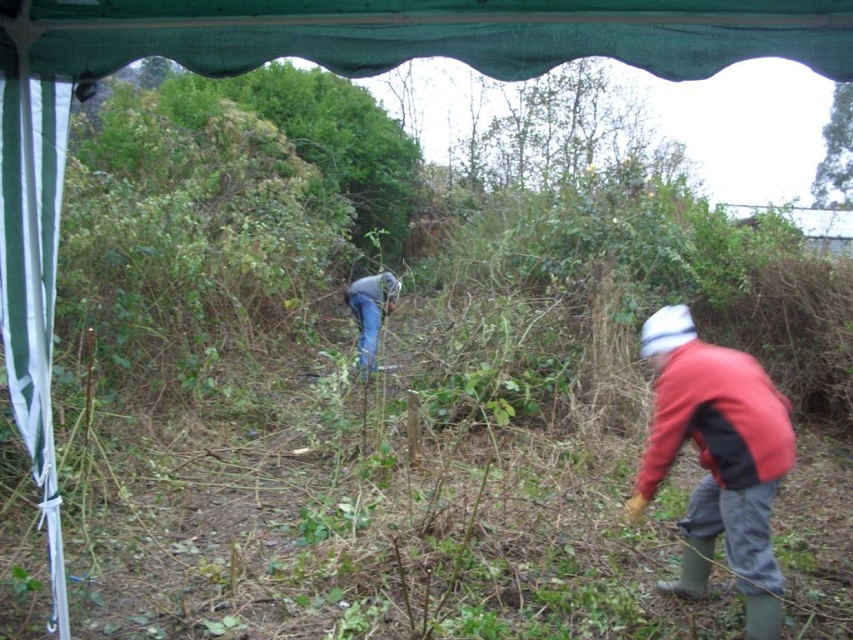
Question: Which object is farther from the camera taking this photo?

Choices:
 (A) red matte jacket at lower right
 (B) denim jeans at center

Answer: (B)

Question: Which of the following is the closest to the observer?

Choices:
 (A) (753, 458)
 (B) (358, 348)

Answer: (A)

Question: Is red matte jacket at lower right thinner than denim jeans at center?

Choices:
 (A) yes
 (B) no

Answer: (A)

Question: Does red matte jacket at lower right have a lesser width compared to denim jeans at center?

Choices:
 (A) yes
 (B) no

Answer: (A)

Question: Does red matte jacket at lower right have a smaller size compared to denim jeans at center?

Choices:
 (A) yes
 (B) no

Answer: (A)